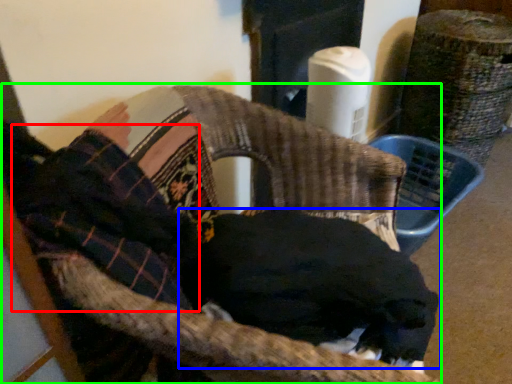
Question: Based on their relative distances, which object is farther from clothing (highlighted by a red box)? Choose from dog (highlighted by a blue box) and chair (highlighted by a green box).

Choices:
 (A) dog
 (B) chair

Answer: (A)